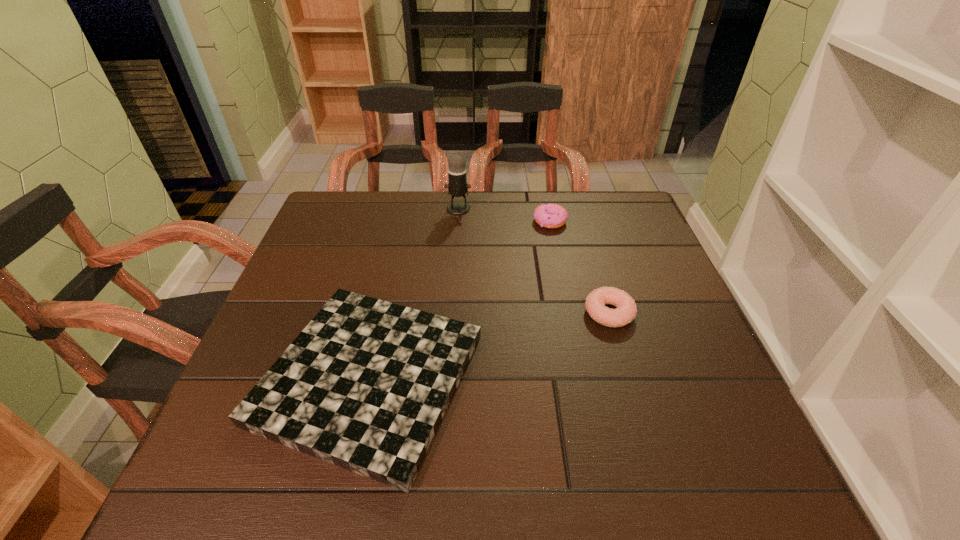
Where is `microphone`? The image size is (960, 540). microphone is located at coordinates (457, 185).

Find the location of a particular element. the farther doughnut is located at coordinates (549, 215).

Locate an element on the screen. The width and height of the screenshot is (960, 540). the nearer doughnut is located at coordinates (626, 310).

At what (x,y) coordinates should I click in order to perform the action: click on checkerboard. Please return your answer as a coordinate pair (x, y). This screenshot has width=960, height=540. Looking at the image, I should click on click(x=365, y=385).

Identify the location of vacant region located on the front of the tallest object. (456, 256).

The image size is (960, 540). I want to click on vacant space located 0.080m on the left of the farther doughnut, so click(x=505, y=221).

Locate an element on the screen. free space located on the front of the nearer doughnut is located at coordinates (626, 369).

Identify the location of vacant region located 0.120m on the back of the checkerboard. The height and width of the screenshot is (540, 960). (394, 266).

This screenshot has width=960, height=540. Identify the location of microphone located in the far edge section of the desktop. (457, 185).

Where is `doughnut that is at the far edge`? This screenshot has height=540, width=960. doughnut that is at the far edge is located at coordinates (549, 215).